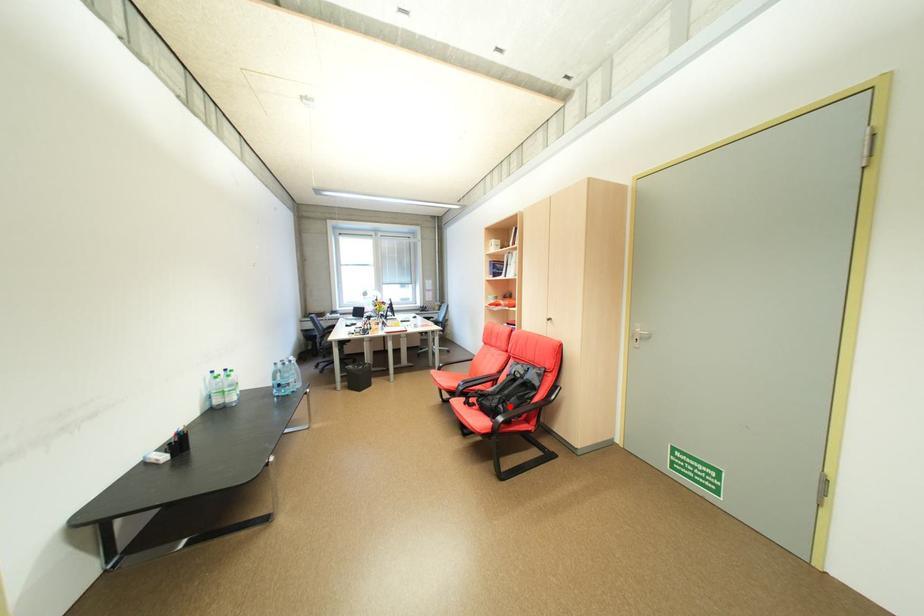
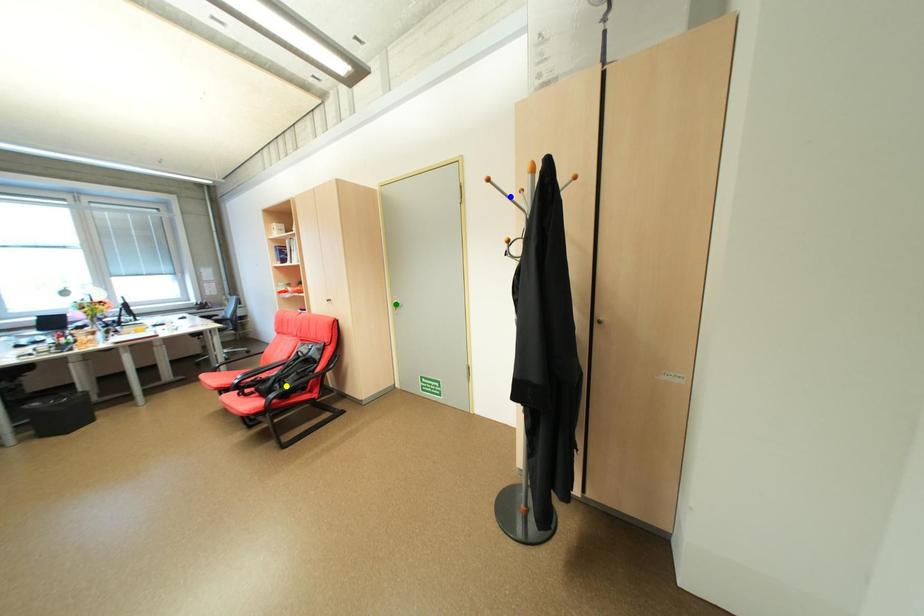
Question: I am providing you with two images of the same scene from different viewpoints. A red point is marked on the first image. You are given multiple points on the second image. Which point in image 2 represents the same 3d spot as the red point in image 1?

Choices:
 (A) blue point
 (B) yellow point
 (C) green point

Answer: (B)